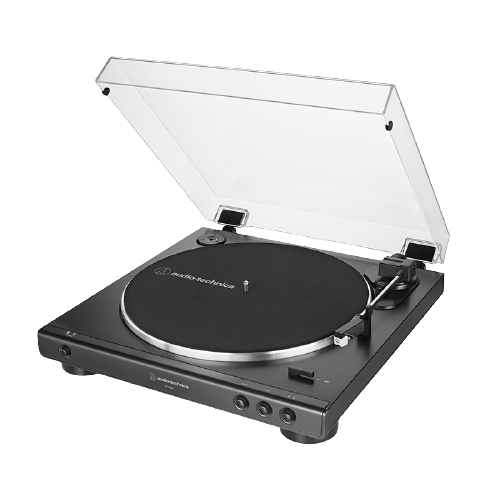
I want to click on hinge, so click(x=419, y=257).